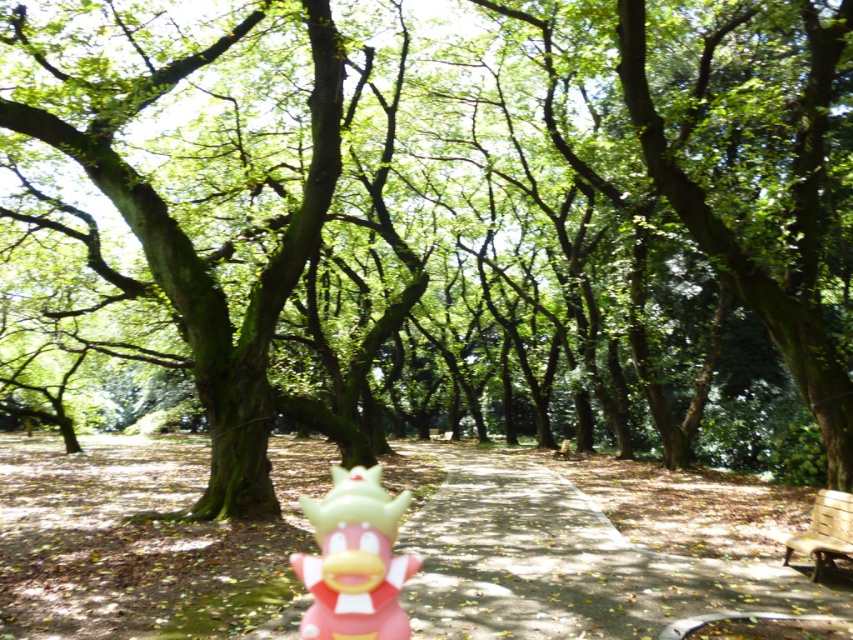
Is pink rubber toy at center positioned at the back of wooden park bench at lower right?

No, pink rubber toy at center is closer to the viewer.

Describe the element at coordinates (354, 561) in the screenshot. I see `pink rubber toy at center` at that location.

I want to click on pink rubber toy at center, so click(354, 561).